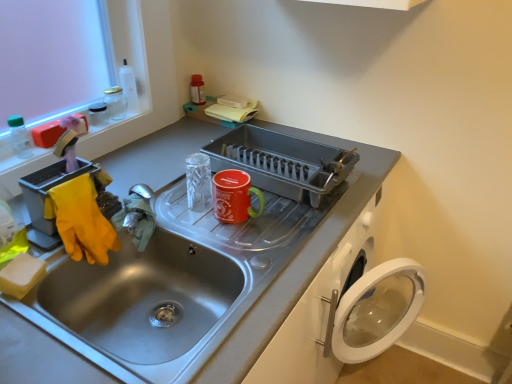
Find the location of a particular element. vacant space to the left of metallic gray dish rack at center, the third appliance from the left is located at coordinates (166, 157).